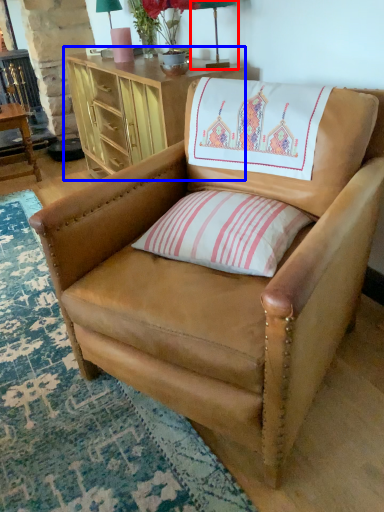
Question: Which object appears farthest to the camera in this image, table lamp (highlighted by a red box) or desk (highlighted by a blue box)?

Choices:
 (A) table lamp
 (B) desk

Answer: (A)